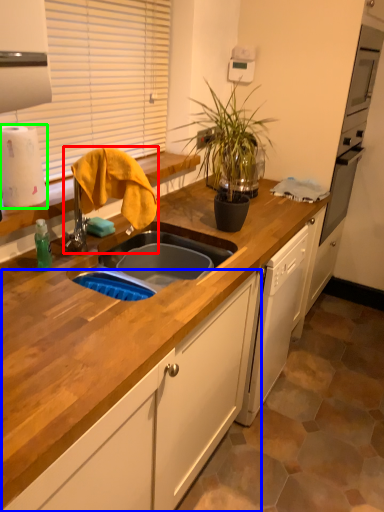
Question: Considering the real-world distances, which object is farthest from faucet (highlighted by a red box)? cabinetry (highlighted by a blue box) or paper towel (highlighted by a green box)?

Choices:
 (A) cabinetry
 (B) paper towel

Answer: (A)